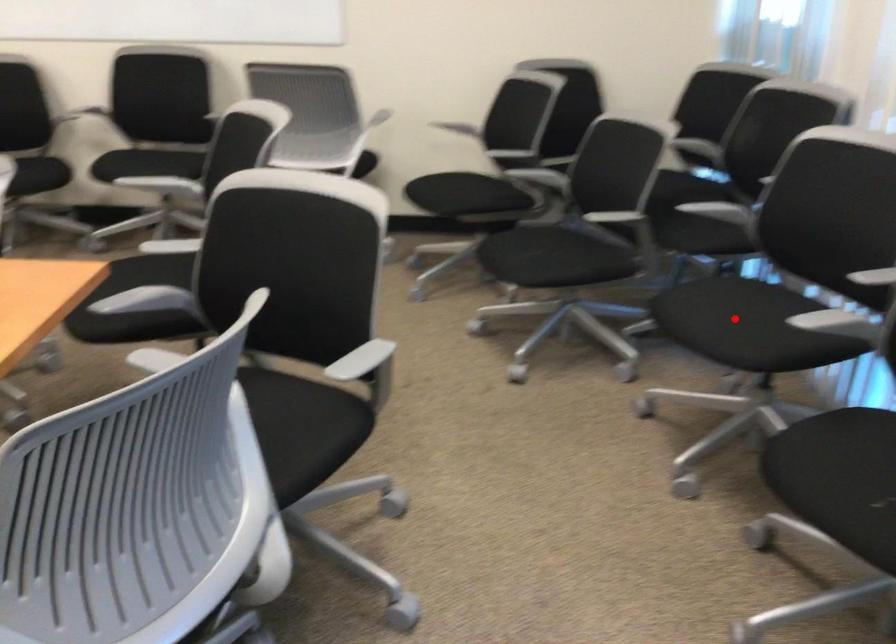
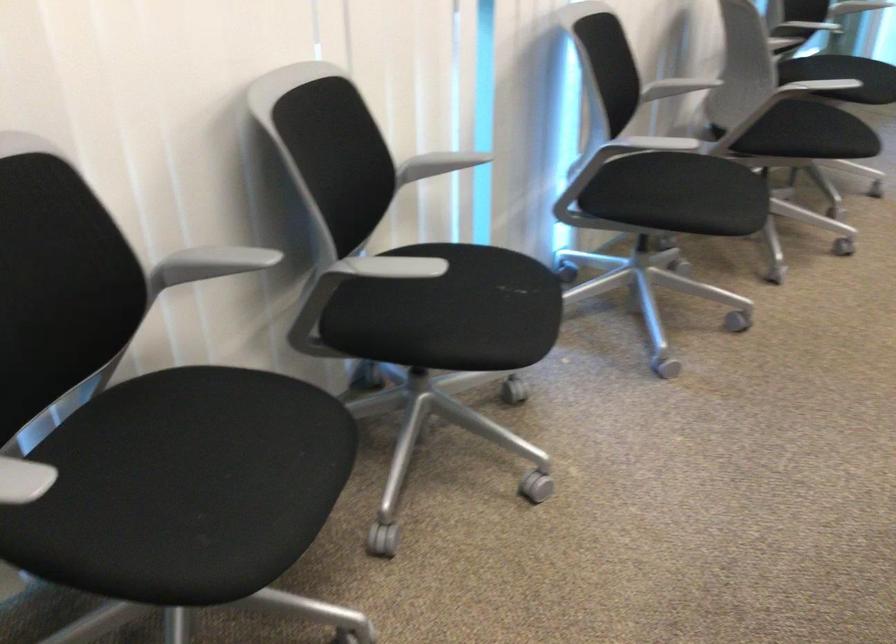
Question: I am providing you with two images of the same scene from different viewpoints. Image1 has a red point marked. In image2, the corresponding 3D location appears at what relative position? Reply with the corresponding letter.

Choices:
 (A) Closer
 (B) Farther

Answer: (A)